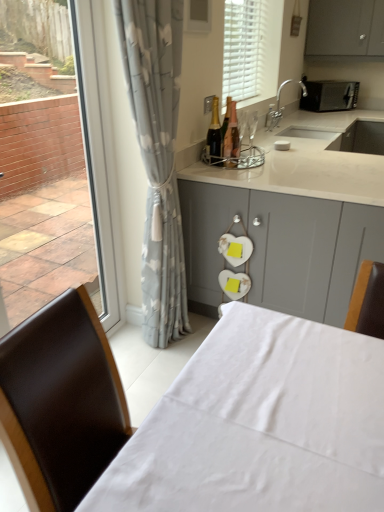
Question: Is white matte blinds at upper center bigger than white fabric table at lower center?

Choices:
 (A) no
 (B) yes

Answer: (A)

Question: Is white matte blinds at upper center further to camera compared to white fabric table at lower center?

Choices:
 (A) no
 (B) yes

Answer: (B)

Question: Can you confirm if white matte blinds at upper center is taller than white fabric table at lower center?

Choices:
 (A) yes
 (B) no

Answer: (B)

Question: Is white matte blinds at upper center at the right side of white fabric table at lower center?

Choices:
 (A) yes
 (B) no

Answer: (A)

Question: From the image's perspective, is white matte blinds at upper center on white fabric table at lower center?

Choices:
 (A) yes
 (B) no

Answer: (A)

Question: Is there a large distance between white matte blinds at upper center and white fabric table at lower center?

Choices:
 (A) yes
 (B) no

Answer: (A)

Question: Would you say shiny gold champagne bottle at center, placed as the 1th bottle when sorted from left to right, contains white matte blinds at upper center?

Choices:
 (A) no
 (B) yes

Answer: (A)

Question: Is shiny gold champagne bottle at center, which ranks as the second bottle in right-to-left order, oriented towards white matte blinds at upper center?

Choices:
 (A) no
 (B) yes

Answer: (A)

Question: Considering the relative sizes of shiny gold champagne bottle at center, placed as the 1th bottle when sorted from left to right, and white matte blinds at upper center in the image provided, is shiny gold champagne bottle at center, placed as the 1th bottle when sorted from left to right, bigger than white matte blinds at upper center?

Choices:
 (A) no
 (B) yes

Answer: (A)

Question: Is shiny gold champagne bottle at center, placed as the 1th bottle when sorted from left to right, next to white matte blinds at upper center and touching it?

Choices:
 (A) no
 (B) yes

Answer: (A)

Question: Is shiny gold champagne bottle at center, which ranks as the second bottle in right-to-left order, to the right of white matte blinds at upper center from the viewer's perspective?

Choices:
 (A) no
 (B) yes

Answer: (A)

Question: Considering the relative positions of shiny gold champagne bottle at center, placed as the 1th bottle when sorted from left to right, and white matte blinds at upper center in the image provided, is shiny gold champagne bottle at center, placed as the 1th bottle when sorted from left to right, to the left of white matte blinds at upper center from the viewer's perspective?

Choices:
 (A) no
 (B) yes

Answer: (B)

Question: Is shiny gold bottle at center, the 2th bottle when ordered from left to right, behind gray floral curtain at left?

Choices:
 (A) no
 (B) yes

Answer: (B)